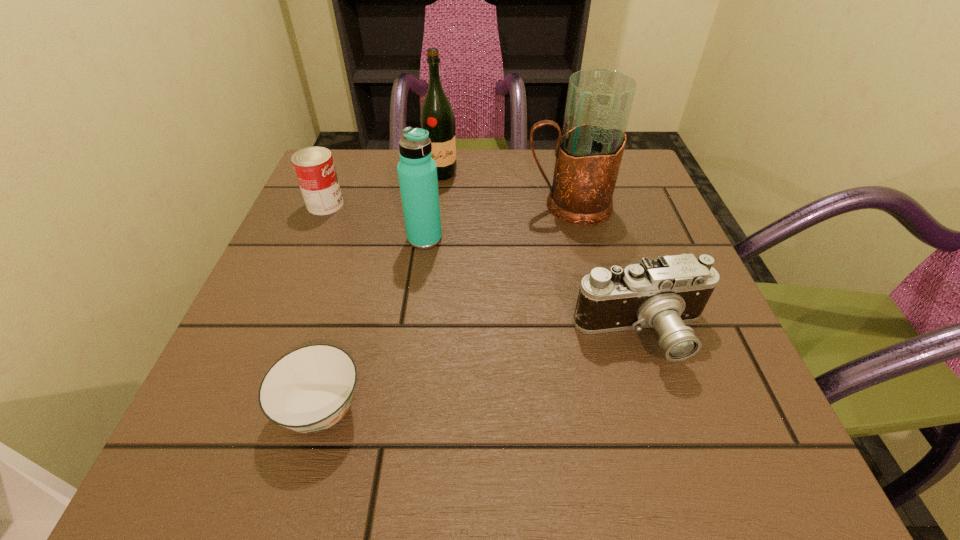
The height and width of the screenshot is (540, 960). Identify the location of the farthest object. (437, 117).

Locate an element on the screen. Image resolution: width=960 pixels, height=540 pixels. pitcher is located at coordinates (589, 151).

What are the coordinates of `water bottle` in the screenshot? It's located at (417, 172).

Identify the location of the fourth shortest object. (417, 172).

At what (x,y) coordinates should I click in order to perform the action: click on can. Please return your answer as a coordinate pair (x, y). Looking at the image, I should click on (314, 167).

Identify the location of camera. Image resolution: width=960 pixels, height=540 pixels. (664, 293).

Identify the location of the second object from left to right. The image size is (960, 540). (308, 390).

Identify the location of soup bowl. This screenshot has width=960, height=540. (308, 390).

Locate an element on the screen. This screenshot has height=540, width=960. free spot located on the front-facing side of the liquor is located at coordinates (439, 196).

You are a GUI agent. You are given a task and a screenshot of the screen. Output one action in this format:
    pyautogui.click(x=<x>, y=<y>)
    Task: Click on the free space located 0.230m with the handle on the side of the pitcher
    This screenshot has height=540, width=960.
    Given the screenshot: What is the action you would take?
    pyautogui.click(x=420, y=206)